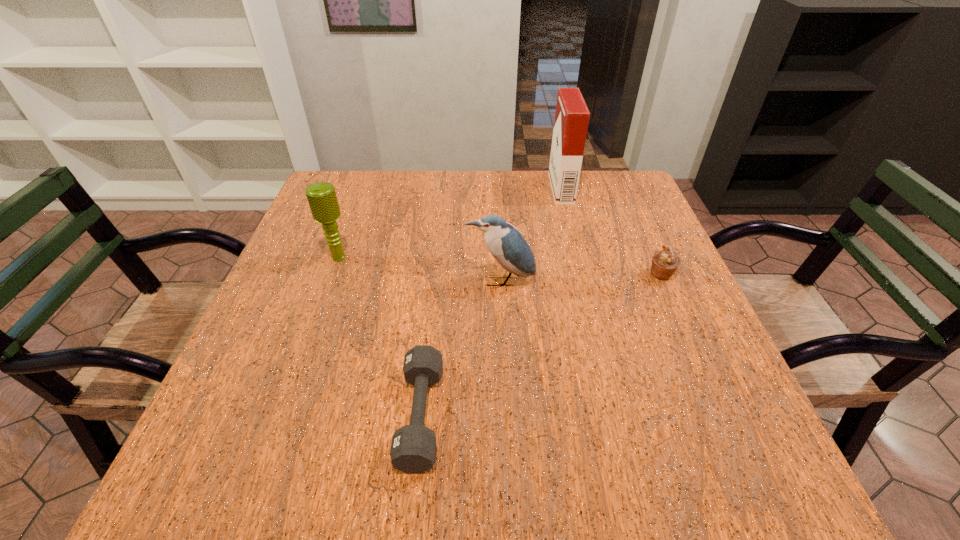
Identify the location of vacant area that lies between the tallest object and the microphone. This screenshot has height=540, width=960. (450, 223).

You are a GUI agent. You are given a task and a screenshot of the screen. Output one action in this format:
    pyautogui.click(x=<x>, y=<y>)
    Task: Click on the empty space that is in between the third object from right to left and the fourth nearest object
    Image resolution: width=960 pixels, height=540 pixels.
    Given the screenshot: What is the action you would take?
    pyautogui.click(x=420, y=269)

At what (x,y) coordinates should I click in order to perform the action: click on vacant area that lies between the shortest object and the fourth object from left to right. Please return your answer as a coordinate pair (x, y). The height and width of the screenshot is (540, 960). Looking at the image, I should click on (491, 302).

The image size is (960, 540). I want to click on vacant space that's between the third object from right to left and the second farthest object, so click(x=420, y=269).

Where is `free space between the dumbbell and the second shortest object`? The height and width of the screenshot is (540, 960). free space between the dumbbell and the second shortest object is located at coordinates (540, 345).

Where is `vacant area that lies between the tallest object and the microphone`? vacant area that lies between the tallest object and the microphone is located at coordinates (450, 223).

The height and width of the screenshot is (540, 960). In order to click on empty location between the muffin and the bird in this screenshot , I will do `click(581, 278)`.

Choose which object is the nearest neighbor to the nearest object. Please provide its 2D coordinates. Your answer should be formatted as a tuple, i.e. [(x, y)], where the tuple contains the x and y coordinates of a point satisfying the conditions above.

[(509, 248)]

Identify which object is located as the third nearest to the fourth nearest object. Please provide its 2D coordinates. Your answer should be formatted as a tuple, i.e. [(x, y)], where the tuple contains the x and y coordinates of a point satisfying the conditions above.

[(572, 116)]

Identify the location of free space that satisfies the following two spatial constraints: 1. on the front-facing side of the second object from right to left; 2. on the front side of the leftmost object. (578, 258).